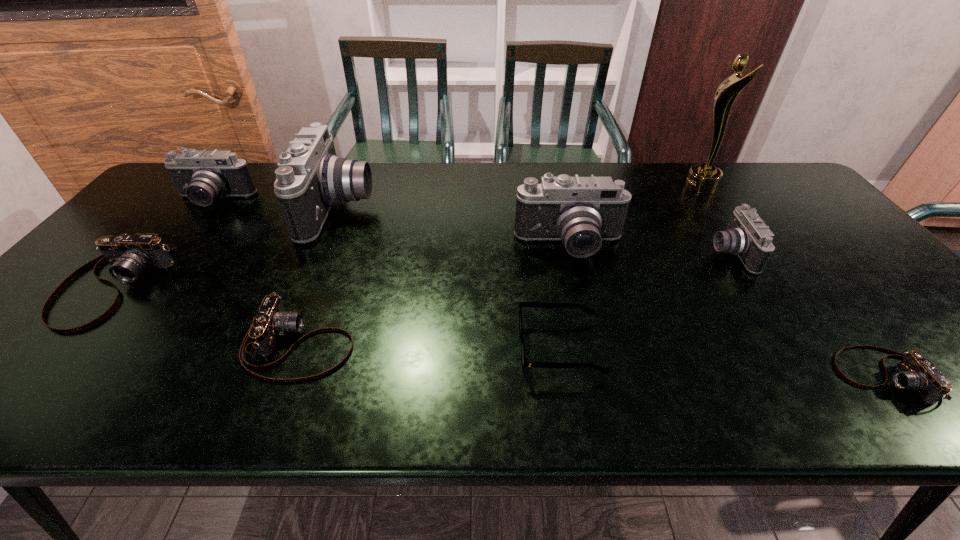
The height and width of the screenshot is (540, 960). Identify the location of the leftmost brown camera. (129, 255).

In order to click on the second smallest brown camera in this screenshot , I will do `click(272, 320)`.

Locate an element on the screen. Image resolution: width=960 pixels, height=540 pixels. the second brown camera from right to left is located at coordinates (272, 320).

The image size is (960, 540). What are the coordinates of `spectacles` in the screenshot? It's located at (589, 311).

Locate an element on the screen. Image resolution: width=960 pixels, height=540 pixels. the rightmost brown camera is located at coordinates (915, 372).

Locate an element on the screen. The image size is (960, 540). the shortest camera is located at coordinates (915, 372).

Where is `vacant space located 0.180m on the front-facing side of the award`? Image resolution: width=960 pixels, height=540 pixels. vacant space located 0.180m on the front-facing side of the award is located at coordinates (631, 187).

Find the location of `vacant area located on the front-facing side of the award`. vacant area located on the front-facing side of the award is located at coordinates (596, 187).

Image resolution: width=960 pixels, height=540 pixels. Identify the location of vacant space located 0.370m on the front-facing side of the award. (572, 187).

Identify the location of free space located 0.380m on the front-facing side of the third black camera from right to left. (497, 210).